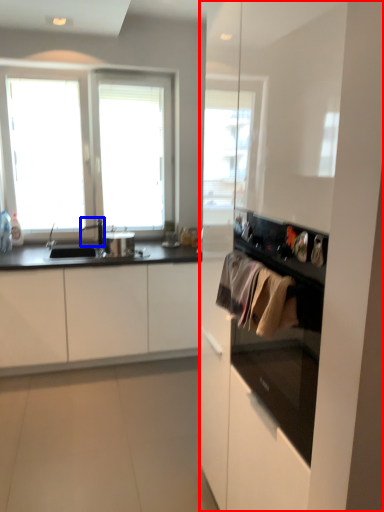
Question: Which of the following is the farthest to the observer, dresser (highlighted by a red box) or faucet (highlighted by a blue box)?

Choices:
 (A) dresser
 (B) faucet

Answer: (B)